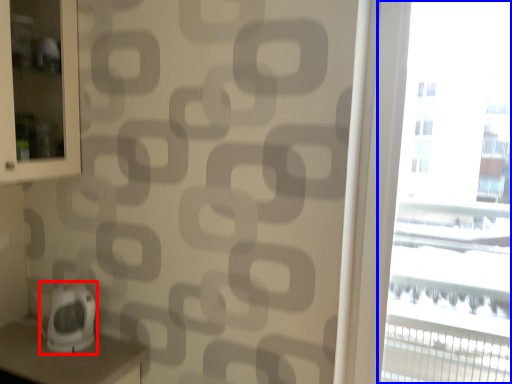
Question: Which object is further to the camera taking this photo, appliance (highlighted by a red box) or window (highlighted by a blue box)?

Choices:
 (A) appliance
 (B) window

Answer: (A)